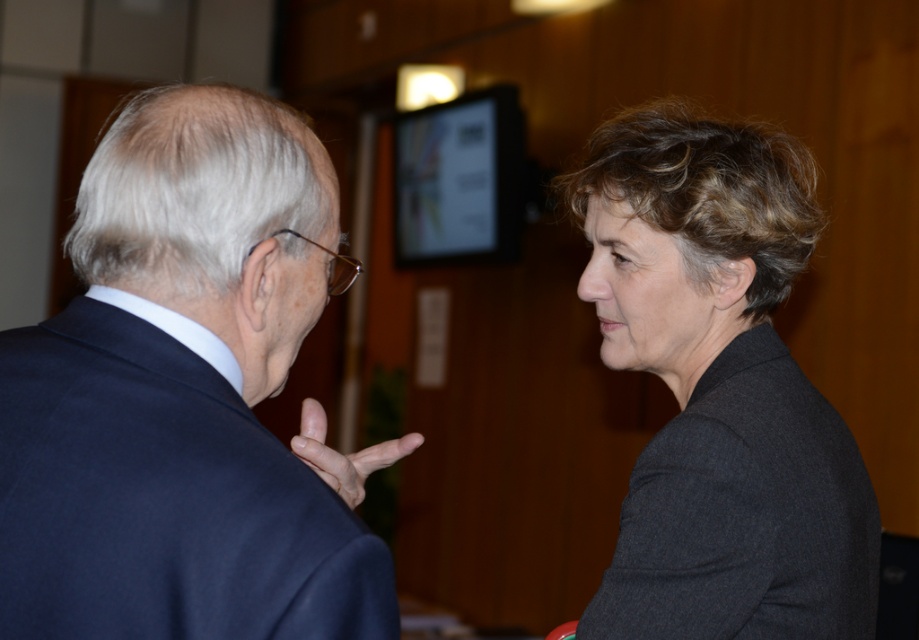
You are a delivery person holding a package that requires a signature. You need to hand it to either the dark blue suit at left or the matte black hand at center. Which one is closer to you?

The dark blue suit at left is closer to you since it is only 5.77 inches away from the matte black hand at center, but without knowing your exact position, it is impossible to determine which is closer. However, if you are positioned between them, the one closer would depend on your location.

You are an interior designer assessing the layout of this room. The dark gray woolen blazer at right and the matte black hand at center are both in the foreground. Which object is positioned higher up in the image?

The dark gray woolen blazer at right is located above matte black hand at center, so it is positioned higher up in the image.